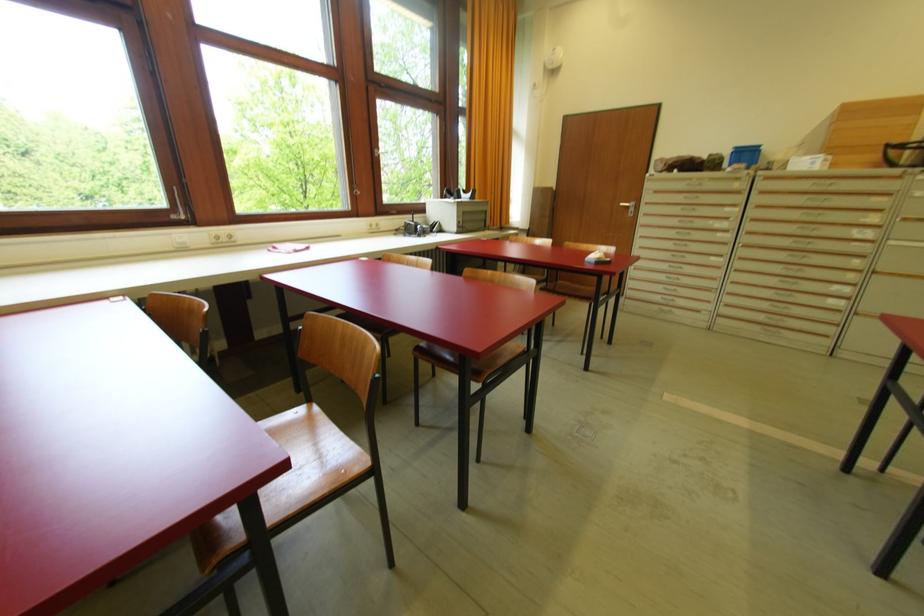
Locate an element on the screen. The height and width of the screenshot is (616, 924). window handle is located at coordinates (81, 121).